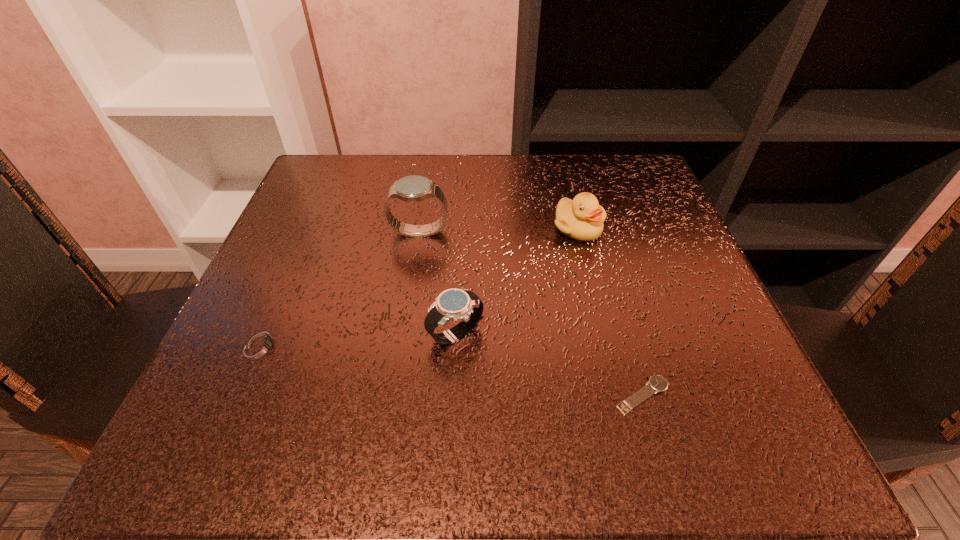
Find the location of a particular element. vacant space at the far edge of the desktop is located at coordinates (468, 200).

This screenshot has width=960, height=540. I want to click on vacant position at the near edge of the desktop, so click(355, 415).

Find the location of a particular element. free space at the left edge of the desktop is located at coordinates (309, 286).

Identify the location of free space at the right edge of the desktop. The height and width of the screenshot is (540, 960). (633, 354).

Where is `vacant space at the far left corner of the desktop`? This screenshot has width=960, height=540. vacant space at the far left corner of the desktop is located at coordinates (363, 193).

This screenshot has height=540, width=960. In the image, there is a desktop. Identify the location of free space at the near left corner. (292, 446).

You are a GUI agent. You are given a task and a screenshot of the screen. Output one action in this format:
    pyautogui.click(x=<x>, y=<y>)
    Task: Click on the blank space at the far right corner of the desktop
    
    Given the screenshot: What is the action you would take?
    pyautogui.click(x=626, y=165)

Identify the location of free space that is in between the duckling and the farthest watch. (498, 230).

The height and width of the screenshot is (540, 960). I want to click on unoccupied position between the third tallest watch and the farthest watch, so tap(340, 289).

Identify the location of free space between the tallest watch and the shortest object. The width and height of the screenshot is (960, 540). (531, 314).